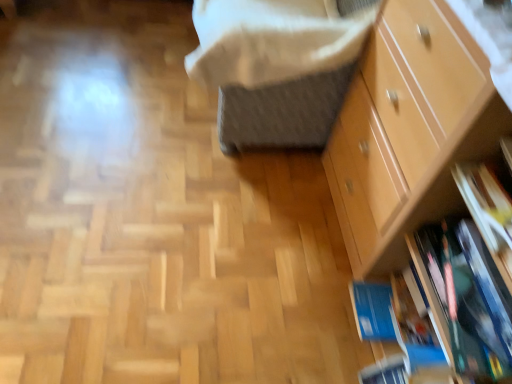
Question: Does light brown wooden chest of drawers at right appear on the left side of white soft blanket at upper center?

Choices:
 (A) no
 (B) yes

Answer: (A)

Question: Considering the relative sizes of light brown wooden chest of drawers at right and white soft blanket at upper center in the image provided, is light brown wooden chest of drawers at right bigger than white soft blanket at upper center?

Choices:
 (A) no
 (B) yes

Answer: (B)

Question: Is light brown wooden chest of drawers at right in front of white soft blanket at upper center?

Choices:
 (A) yes
 (B) no

Answer: (A)

Question: Considering the relative sizes of light brown wooden chest of drawers at right and white soft blanket at upper center in the image provided, is light brown wooden chest of drawers at right shorter than white soft blanket at upper center?

Choices:
 (A) no
 (B) yes

Answer: (A)

Question: From the image's perspective, would you say light brown wooden chest of drawers at right is positioned over white soft blanket at upper center?

Choices:
 (A) no
 (B) yes

Answer: (A)

Question: Is the depth of light brown wooden chest of drawers at right greater than that of white soft blanket at upper center?

Choices:
 (A) yes
 (B) no

Answer: (B)

Question: From the image's perspective, would you say white soft blanket at upper center is positioned over light brown wooden chest of drawers at right?

Choices:
 (A) yes
 (B) no

Answer: (A)

Question: Considering the relative positions of white soft blanket at upper center and light brown wooden chest of drawers at right in the image provided, is white soft blanket at upper center to the right of light brown wooden chest of drawers at right from the viewer's perspective?

Choices:
 (A) no
 (B) yes

Answer: (A)

Question: Does white soft blanket at upper center come in front of light brown wooden chest of drawers at right?

Choices:
 (A) no
 (B) yes

Answer: (A)

Question: Does white soft blanket at upper center have a lesser width compared to light brown wooden chest of drawers at right?

Choices:
 (A) no
 (B) yes

Answer: (A)

Question: Can you see white soft blanket at upper center touching light brown wooden chest of drawers at right?

Choices:
 (A) no
 (B) yes

Answer: (A)

Question: From the image's perspective, does white soft blanket at upper center appear lower than light brown wooden chest of drawers at right?

Choices:
 (A) no
 (B) yes

Answer: (A)

Question: Would you say blue matte book at lower right is part of light brown wooden chest of drawers at right's contents?

Choices:
 (A) yes
 (B) no

Answer: (A)